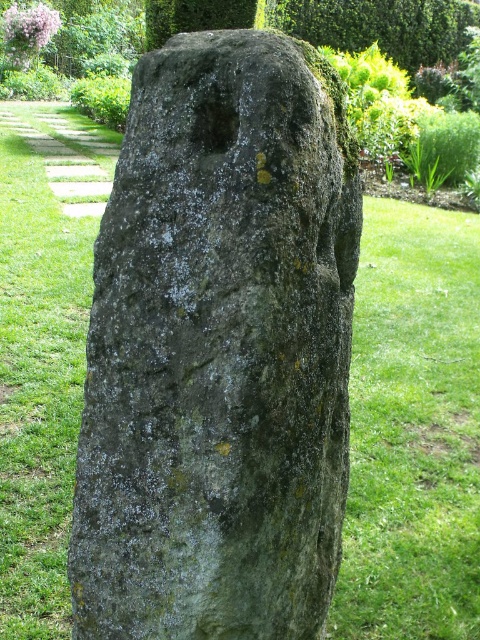
Is green mossy stone at center shorter than green leafy hedge at upper center?

Yes, green mossy stone at center is shorter than green leafy hedge at upper center.

Can you confirm if green mossy stone at center is positioned below green leafy hedge at upper center?

Correct, green mossy stone at center is located below green leafy hedge at upper center.

Which is behind, point (202, 257) or point (331, 26)?

Positioned behind is point (331, 26).

The image size is (480, 640). I want to click on green mossy stone at center, so click(218, 349).